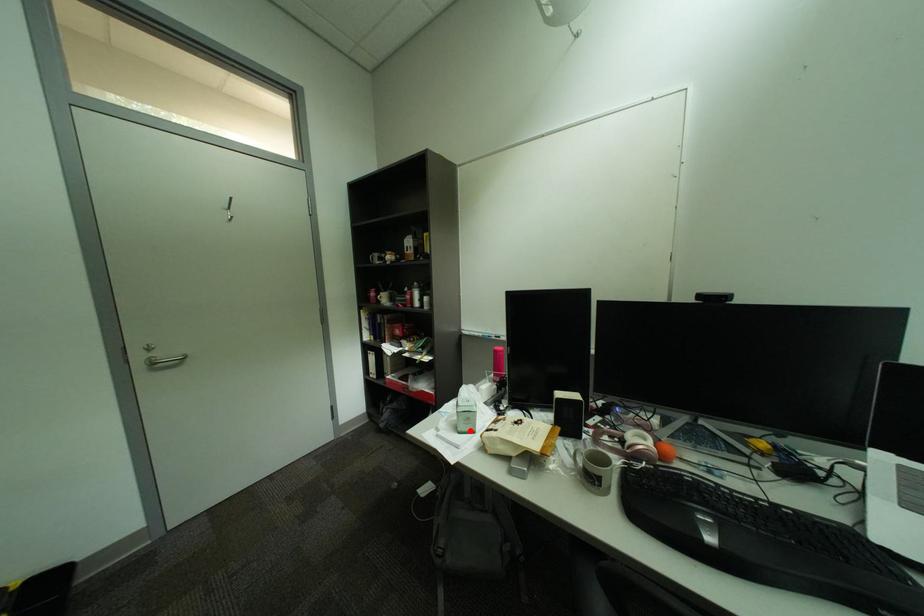
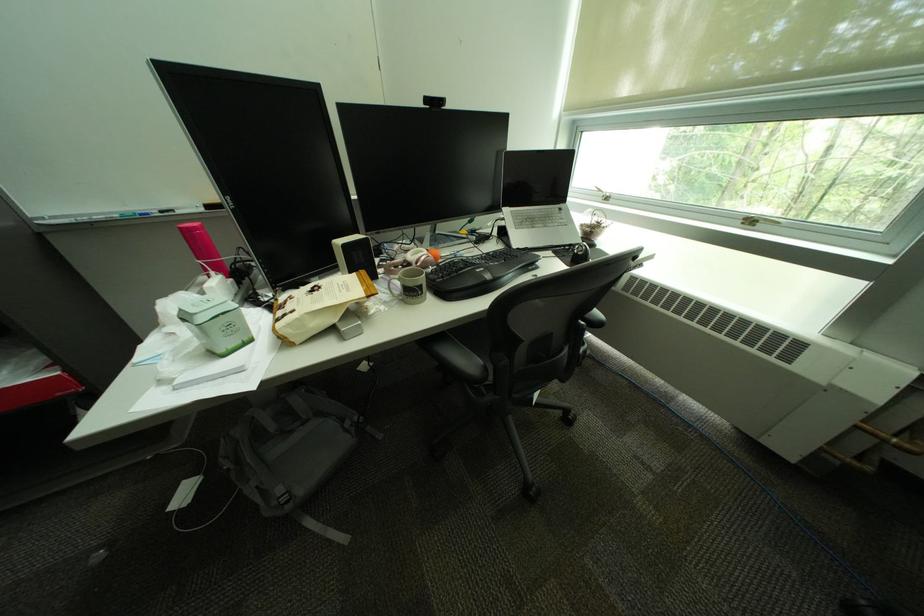
In the second image, find the point that corresponds to the highlighted location in the first image.

(232, 353)